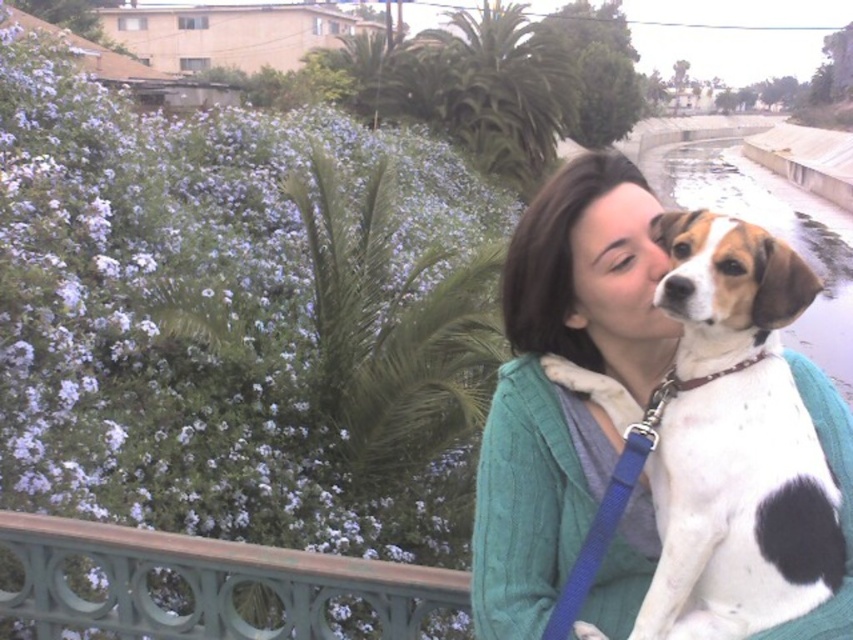
Question: Among these objects, which one is nearest to the camera?

Choices:
 (A) purple matte flowers at upper left
 (B) green painted metal railing at lower left

Answer: (B)

Question: Can you confirm if white-spotted fur dog at center is positioned below green painted metal railing at lower left?

Choices:
 (A) no
 (B) yes

Answer: (A)

Question: Which object appears farthest from the camera in this image?

Choices:
 (A) green painted metal railing at lower left
 (B) purple matte flowers at upper left
 (C) white-spotted fur dog at center

Answer: (B)

Question: Does purple matte flowers at upper left have a lesser width compared to white-spotted fur dog at center?

Choices:
 (A) no
 (B) yes

Answer: (B)

Question: Considering the real-world distances, which object is farthest from the purple matte flowers at upper left?

Choices:
 (A) white-spotted fur dog at center
 (B) green painted metal railing at lower left

Answer: (A)

Question: Is white-spotted fur dog at center closer to the viewer compared to green painted metal railing at lower left?

Choices:
 (A) yes
 (B) no

Answer: (A)